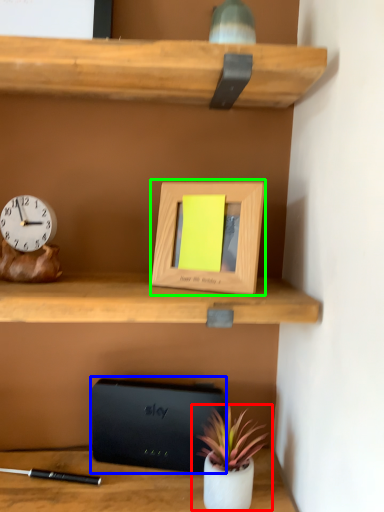
Question: Which is farther away from houseplant (highlighted by a red box)? paperback book (highlighted by a blue box) or picture frame (highlighted by a green box)?

Choices:
 (A) paperback book
 (B) picture frame

Answer: (B)